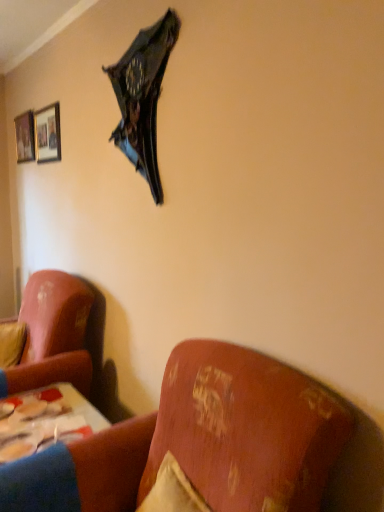
Question: Is wooden framed picture at upper left, the second picture frame when ordered from right to left, taller than wooden table at lower left?

Choices:
 (A) no
 (B) yes

Answer: (B)

Question: Is wooden framed picture at upper left, arranged as the 1th picture frame when viewed from the left, in front of wooden table at lower left?

Choices:
 (A) yes
 (B) no

Answer: (B)

Question: Considering the relative sizes of wooden framed picture at upper left, arranged as the 1th picture frame when viewed from the left, and wooden table at lower left in the image provided, is wooden framed picture at upper left, arranged as the 1th picture frame when viewed from the left, shorter than wooden table at lower left?

Choices:
 (A) yes
 (B) no

Answer: (B)

Question: Considering the relative sizes of wooden framed picture at upper left, marked as the 2th picture frame in a front-to-back arrangement, and wooden table at lower left in the image provided, is wooden framed picture at upper left, marked as the 2th picture frame in a front-to-back arrangement, wider than wooden table at lower left?

Choices:
 (A) no
 (B) yes

Answer: (A)

Question: Is wooden framed picture at upper left, the second picture frame when ordered from right to left, far away from wooden table at lower left?

Choices:
 (A) no
 (B) yes

Answer: (B)

Question: Is wooden framed picture at upper left, marked as the 2th picture frame in a front-to-back arrangement, positioned behind wooden table at lower left?

Choices:
 (A) no
 (B) yes

Answer: (B)

Question: Is shiny metallic umbrella at upper center completely or partially inside matte black picture frame at upper left, the 2th picture frame viewed from the back?

Choices:
 (A) yes
 (B) no

Answer: (B)

Question: From a real-world perspective, does matte black picture frame at upper left, the 2th picture frame viewed from the back, sit lower than shiny metallic umbrella at upper center?

Choices:
 (A) no
 (B) yes

Answer: (A)

Question: From the image's perspective, is matte black picture frame at upper left, the first picture frame from the right, above shiny metallic umbrella at upper center?

Choices:
 (A) no
 (B) yes

Answer: (B)

Question: Is the depth of matte black picture frame at upper left, the second picture frame from the left, greater than that of shiny metallic umbrella at upper center?

Choices:
 (A) no
 (B) yes

Answer: (B)

Question: Is matte black picture frame at upper left, which is the 1th picture frame from front to back, at the left side of shiny metallic umbrella at upper center?

Choices:
 (A) no
 (B) yes

Answer: (B)

Question: Does matte black picture frame at upper left, the first picture frame from the right, touch shiny metallic umbrella at upper center?

Choices:
 (A) no
 (B) yes

Answer: (A)

Question: Considering the relative positions of wooden framed picture at upper left, arranged as the 1th picture frame when viewed from the back, and shiny metallic umbrella at upper center in the image provided, is wooden framed picture at upper left, arranged as the 1th picture frame when viewed from the back, to the right of shiny metallic umbrella at upper center from the viewer's perspective?

Choices:
 (A) no
 (B) yes

Answer: (A)